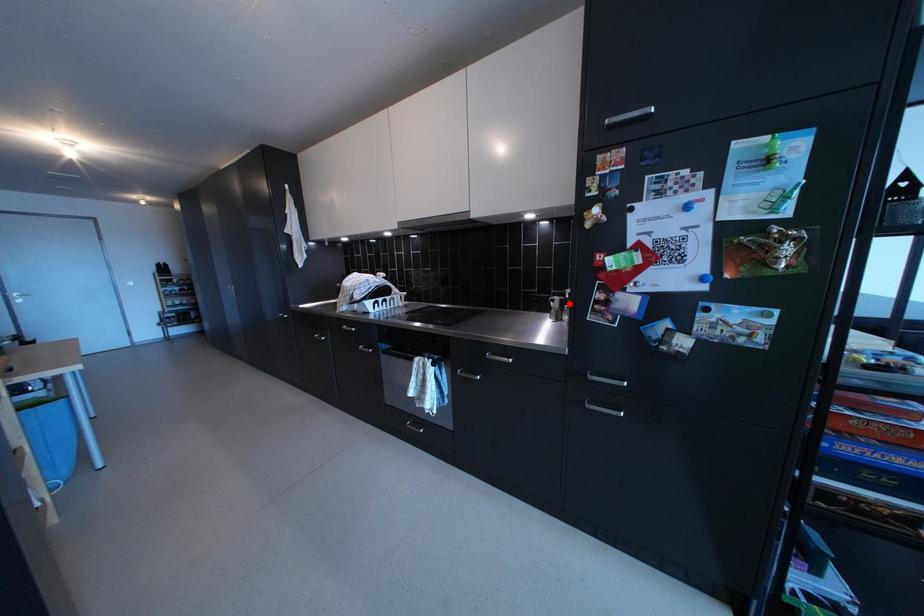
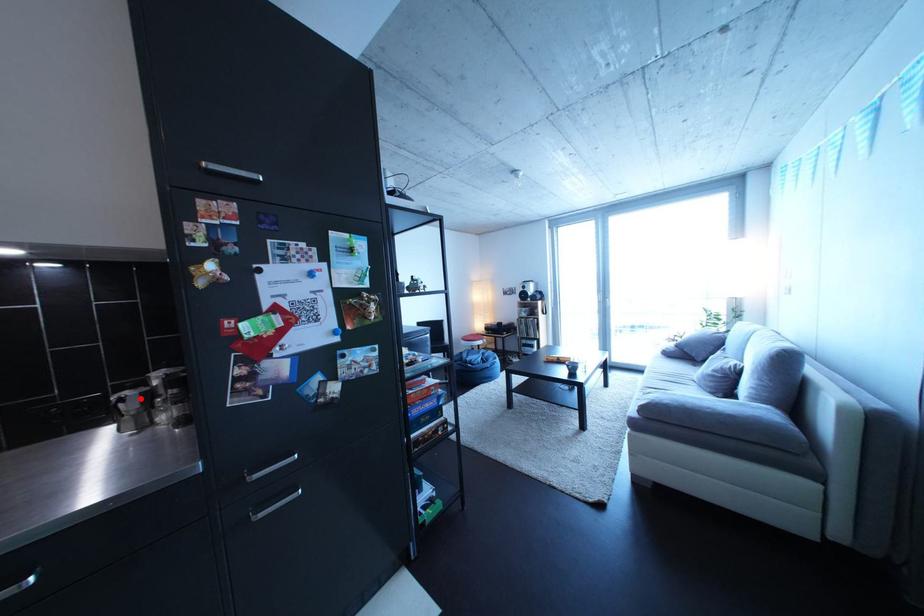
I am providing you with two images of the same scene from different viewpoints. A red point is marked on the first image and another point is marked on the second image. Is the red point in image1 aligned with the point shown in image2?

Yes